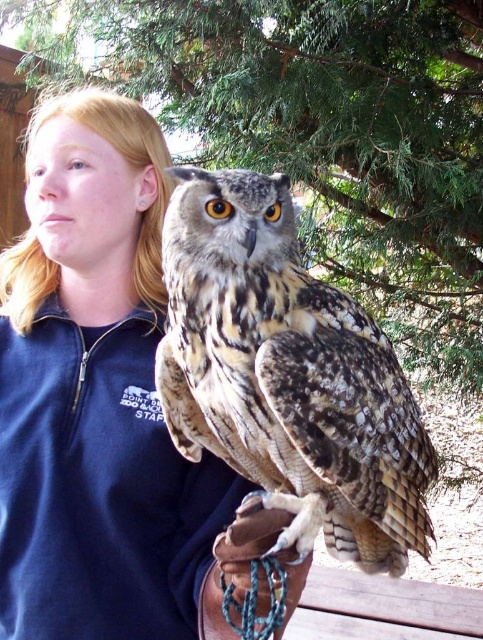
Can you confirm if green leafy tree at upper center is bigger than brown speckled feathers at center?

Yes.

Who is positioned more to the left, green leafy tree at upper center or brown speckled feathers at center?

From the viewer's perspective, brown speckled feathers at center appears more on the left side.

Identify the location of green leafy tree at upper center. The height and width of the screenshot is (640, 483). (x=326, y=132).

Is point (102, 618) closer to camera compared to point (344, 163)?

Yes, point (102, 618) is in front of point (344, 163).

Is blue fleece jacket at upper left thinner than green leafy tree at upper center?

Correct, blue fleece jacket at upper left's width is less than green leafy tree at upper center's.

Is point (85, 307) closer to camera compared to point (318, 202)?

Yes, point (85, 307) is in front of point (318, 202).

I want to click on blue fleece jacket at upper left, so click(x=100, y=401).

This screenshot has width=483, height=640. What do you see at coordinates (100, 401) in the screenshot?
I see `blue fleece jacket at upper left` at bounding box center [100, 401].

Which is above, blue fleece jacket at upper left or brown leather glove at lower center?

Positioned higher is blue fleece jacket at upper left.

Between point (28, 332) and point (260, 500), which one is positioned behind?

The point (28, 332) is behind.

You are a GUI agent. You are given a task and a screenshot of the screen. Output one action in this format:
    pyautogui.click(x=<x>, y=<y>)
    Task: Click on the blue fleece jacket at upper left
    This screenshot has width=483, height=640.
    Given the screenshot: What is the action you would take?
    pyautogui.click(x=100, y=401)